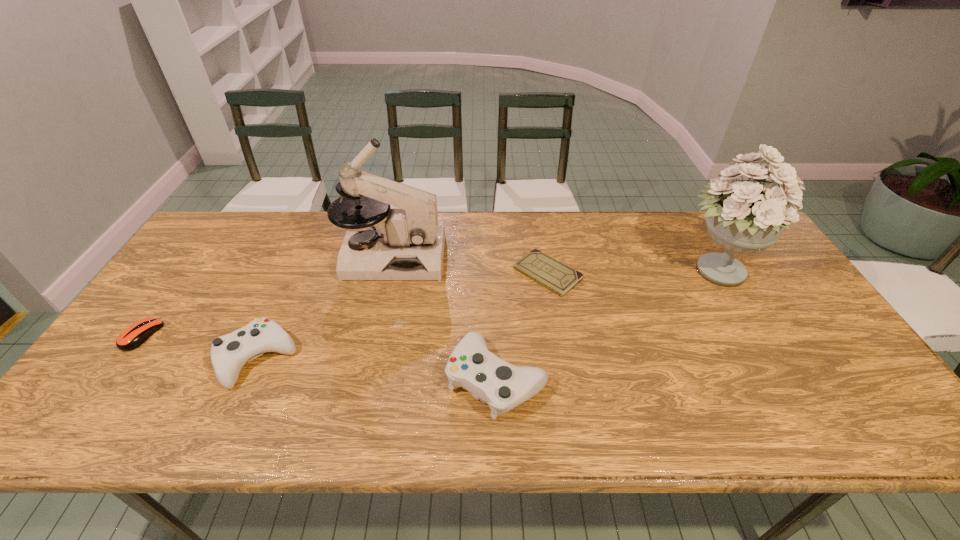
Identify the location of free space located 0.370m on the back of the right control. (492, 249).

You are a GUI agent. You are given a task and a screenshot of the screen. Output one action in this format:
    pyautogui.click(x=<x>, y=<y>)
    Task: Click on the vacant space located 0.330m at the eyepiece of the microscope
    The width and height of the screenshot is (960, 540).
    Given the screenshot: What is the action you would take?
    pyautogui.click(x=550, y=257)

Locate an element on the screen. vacant space located 0.380m on the left of the rightmost object is located at coordinates (546, 271).

Locate an element on the screen. The height and width of the screenshot is (540, 960). vacant point located on the right of the shortest object is located at coordinates (652, 274).

At what (x,y) coordinates should I click in order to perform the action: click on vacant space located 0.080m on the front of the computer mouse. Please return your answer as a coordinate pair (x, y). The height and width of the screenshot is (540, 960). Looking at the image, I should click on (110, 380).

The image size is (960, 540). What are the coordinates of `microscope positioned at the far edge` in the screenshot? It's located at (406, 244).

You are a GUI agent. You are given a task and a screenshot of the screen. Output one action in this format:
    pyautogui.click(x=<x>, y=<y>)
    Task: Click on the bouquet located in the far edge section of the desktop
    The height and width of the screenshot is (540, 960).
    Given the screenshot: What is the action you would take?
    pyautogui.click(x=746, y=217)

The width and height of the screenshot is (960, 540). I want to click on checkbook at the far edge, so click(x=545, y=270).

Identify the location of object located at the left edge. This screenshot has width=960, height=540. (131, 338).

Locate an element on the screen. Image resolution: width=960 pixels, height=540 pixels. object that is at the right edge is located at coordinates (746, 217).